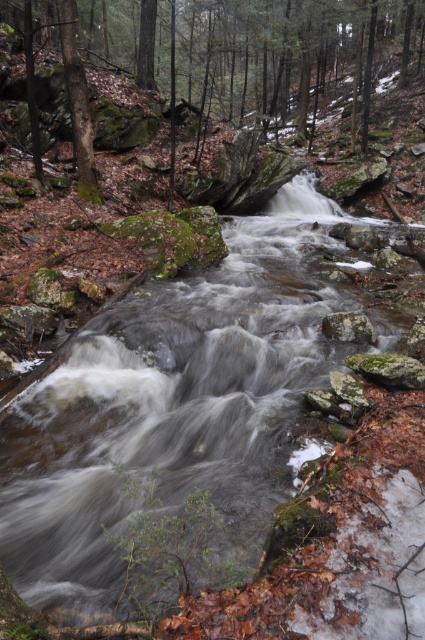
You are a hiker who needs to cross the stream. The smooth rock stream at center is flowing quickly. There is a green mossy tree at left nearby. How far apart are these two landmarks?

The smooth rock stream at center and the green mossy tree at left are 17.34 feet apart.

You are standing at the edge of the forest stream. There is a point marked at coordinates point (54, 529). Can you reach that point without getting your shoes wet?

The distance between you and point (54, 529) is 11.63 feet. Since the stream is flowing and the point is part of the water area, you would need to cross the stream to reach it, which might get your shoes wet.